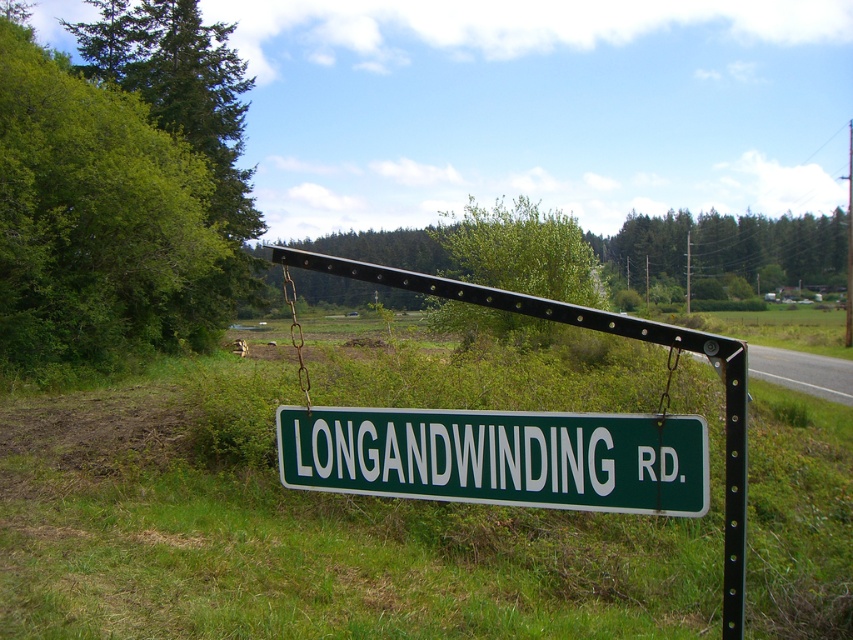
Question: Can you confirm if green grass at center is positioned to the right of green plastic sign at center?

Choices:
 (A) no
 (B) yes

Answer: (B)

Question: In this image, where is green grass at center located relative to green plastic sign at center?

Choices:
 (A) above
 (B) below

Answer: (B)

Question: Which of the following is the farthest from the observer?

Choices:
 (A) (100, 388)
 (B) (334, 483)

Answer: (A)

Question: Does green grass at center come in front of green plastic sign at center?

Choices:
 (A) yes
 (B) no

Answer: (B)

Question: Which object is closer to the camera taking this photo?

Choices:
 (A) green grass at center
 (B) green plastic sign at center

Answer: (B)